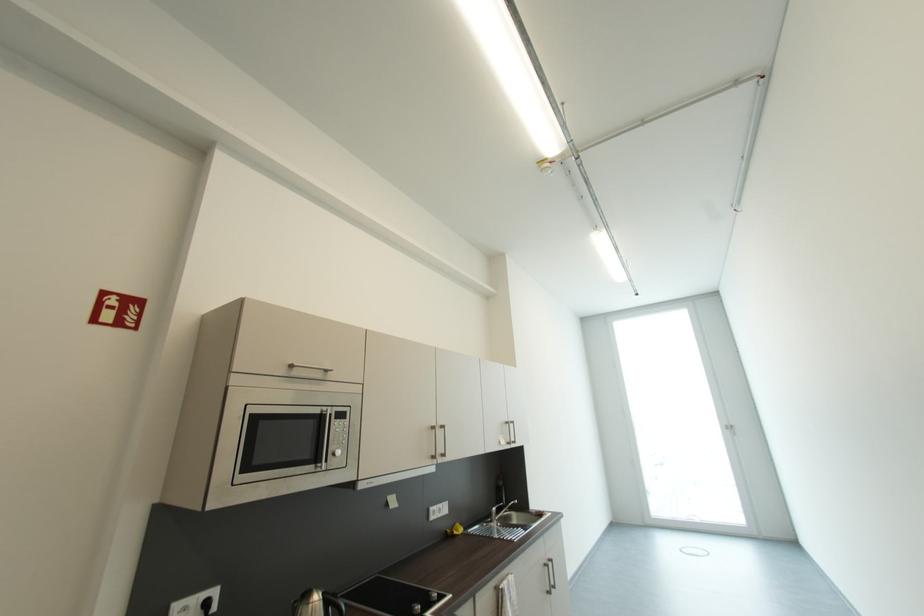
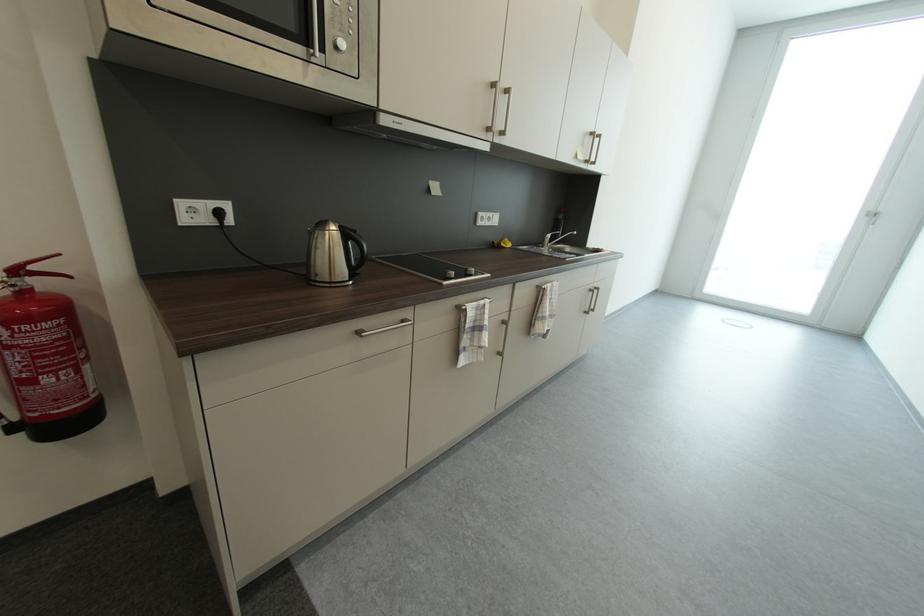
Find the pixel in the second image that matches the point at 344,446 in the first image.

(347, 33)